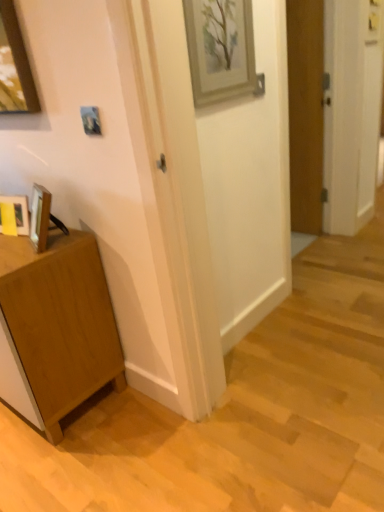
Question: Is matte wooden picture frame at lower left, which ranks as the first picture frame in bottom-to-top order, to the left of metallic silver picture frame at upper center, the second picture frame from the right, from the viewer's perspective?

Choices:
 (A) no
 (B) yes

Answer: (B)

Question: From the image's perspective, would you say matte wooden picture frame at lower left, the first picture frame in the left-to-right sequence, is shown under metallic silver picture frame at upper center, the second picture frame from the right?

Choices:
 (A) no
 (B) yes

Answer: (B)

Question: Considering the relative sizes of matte wooden picture frame at lower left, the 3th picture frame in the right-to-left sequence, and metallic silver picture frame at upper center, which ranks as the second picture frame in left-to-right order, in the image provided, is matte wooden picture frame at lower left, the 3th picture frame in the right-to-left sequence, smaller than metallic silver picture frame at upper center, which ranks as the second picture frame in left-to-right order,?

Choices:
 (A) no
 (B) yes

Answer: (A)

Question: From the image's perspective, would you say matte wooden picture frame at lower left, arranged as the third picture frame when viewed from the top, is positioned over metallic silver picture frame at upper center, the second picture frame when ordered from top to bottom?

Choices:
 (A) no
 (B) yes

Answer: (A)

Question: From a real-world perspective, is matte wooden picture frame at lower left, the 3th picture frame in the right-to-left sequence, physically below metallic silver picture frame at upper center, the second picture frame from the right?

Choices:
 (A) no
 (B) yes

Answer: (B)

Question: Can you see matte wooden picture frame at lower left, arranged as the third picture frame when viewed from the top, touching metallic silver picture frame at upper center, positioned as the 2th picture frame in bottom-to-top order?

Choices:
 (A) yes
 (B) no

Answer: (B)

Question: Does metallic silver picture frame at upper center, the second picture frame from the right, have a greater width compared to wooden framed picture at upper center, positioned as the 3th picture frame in left-to-right order?

Choices:
 (A) yes
 (B) no

Answer: (B)

Question: From the image's perspective, is metallic silver picture frame at upper center, which ranks as the second picture frame in left-to-right order, below wooden framed picture at upper center, which is the first picture frame from right to left?

Choices:
 (A) yes
 (B) no

Answer: (A)

Question: Is the depth of metallic silver picture frame at upper center, the second picture frame from the right, less than that of wooden framed picture at upper center, which is the first picture frame from right to left?

Choices:
 (A) no
 (B) yes

Answer: (B)

Question: Could you tell me if metallic silver picture frame at upper center, positioned as the 2th picture frame in bottom-to-top order, is facing wooden framed picture at upper center, positioned as the third picture frame in bottom-to-top order?

Choices:
 (A) yes
 (B) no

Answer: (B)

Question: Is metallic silver picture frame at upper center, which ranks as the second picture frame in left-to-right order, further to camera compared to wooden framed picture at upper center, which is the first picture frame from right to left?

Choices:
 (A) yes
 (B) no

Answer: (B)

Question: Is metallic silver picture frame at upper center, which ranks as the second picture frame in left-to-right order, shorter than wooden framed picture at upper center, which appears as the 1th picture frame when viewed from the top?

Choices:
 (A) yes
 (B) no

Answer: (A)

Question: From a real-world perspective, does wooden door at right sit lower than matte wooden picture frame at lower left, the first picture frame in the left-to-right sequence?

Choices:
 (A) no
 (B) yes

Answer: (B)